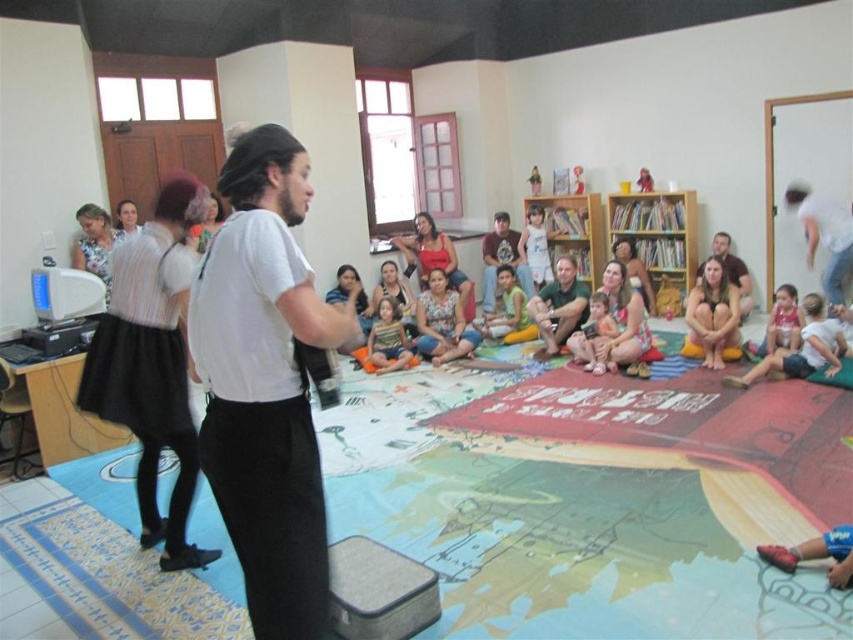
Question: Which object is farther from the camera taking this photo?

Choices:
 (A) matte red shirt at lower right
 (B) yellow-green fabric at center
 (C) matte yellow shorts at lower right
 (D) matte brown shirt at center

Answer: (D)

Question: Does matte green shirt at center appear on the left side of matte brown shirt at center?

Choices:
 (A) yes
 (B) no

Answer: (B)

Question: Which object appears farthest from the camera in this image?

Choices:
 (A) matte yellow shorts at lower right
 (B) striped fabric shirt at center

Answer: (B)

Question: Does white cotton shirt at upper right appear on the right side of matte brown shirt at center?

Choices:
 (A) no
 (B) yes

Answer: (B)

Question: Which of the following is the farthest from the observer?

Choices:
 (A) matte brown shirt at center
 (B) matte green shirt at center
 (C) pink fabric at center

Answer: (A)

Question: Can you confirm if white cotton shirt at center is positioned to the left of matte brown shirt at center?

Choices:
 (A) yes
 (B) no

Answer: (A)